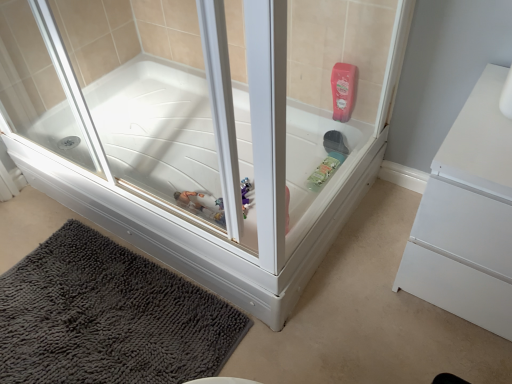
Question: From the image's perspective, is white glossy bathtub at center positioned above or below white matte dresser at right?

Choices:
 (A) above
 (B) below

Answer: (A)

Question: In the image, is white glossy bathtub at center positioned in front of or behind white matte dresser at right?

Choices:
 (A) front
 (B) behind

Answer: (A)

Question: Which object is positioned farthest from the white glossy bathtub at center?

Choices:
 (A) dark gray shaggy bath mat at lower left
 (B) white matte dresser at right

Answer: (B)

Question: Estimate the real-world distances between objects in this image. Which object is closer to the white matte dresser at right?

Choices:
 (A) white glossy bathtub at center
 (B) dark gray shaggy bath mat at lower left

Answer: (A)